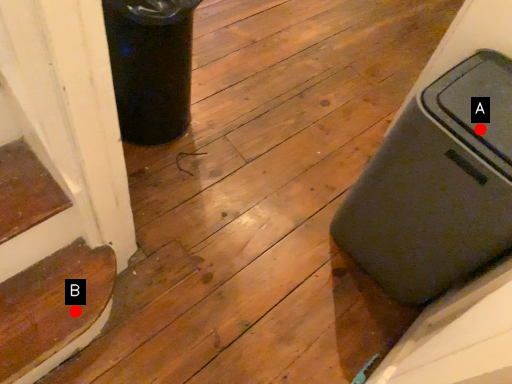
Question: Two points are circled on the image, labeled by A and B beside each circle. Which point is closer to the camera taking this photo?

Choices:
 (A) A is closer
 (B) B is closer

Answer: (A)